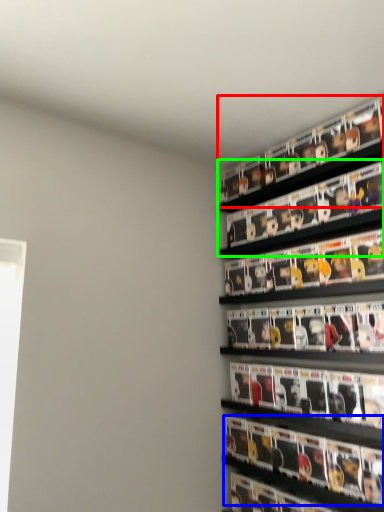
Question: Based on their relative distances, which object is farther from shelf (highlighted by a red box)? Choose from magazine (highlighted by a blue box) and shelf (highlighted by a green box).

Choices:
 (A) magazine
 (B) shelf

Answer: (A)